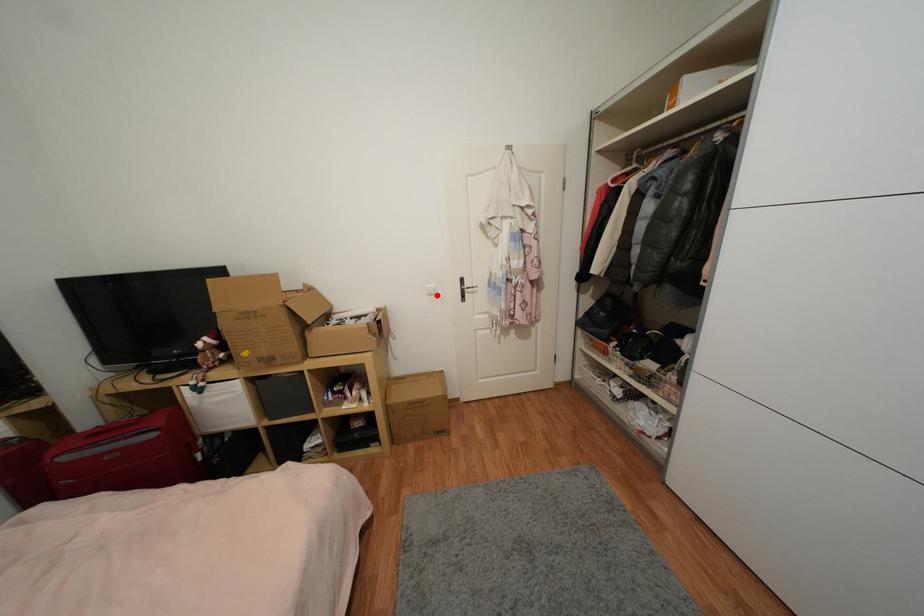
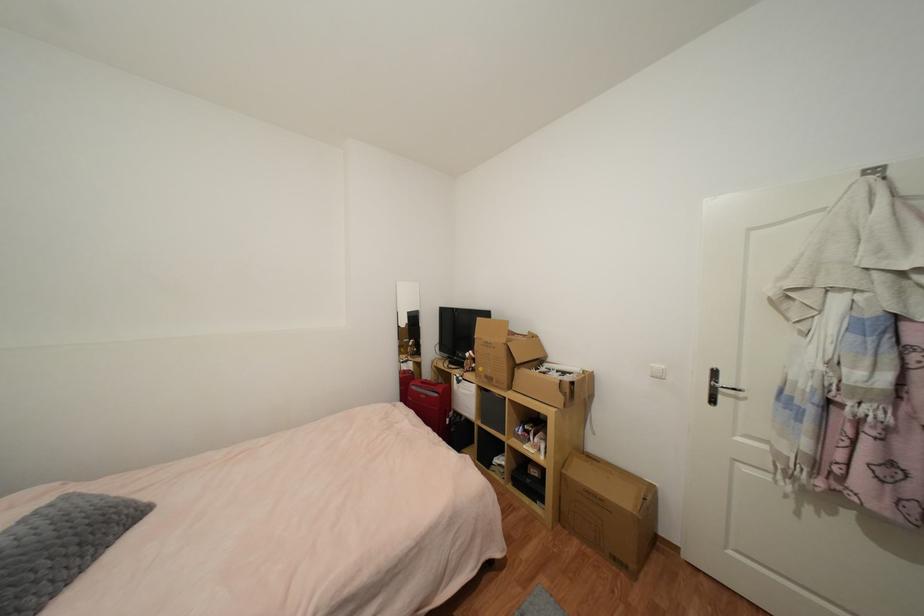
In the second image, find the point that corresponds to the highlighted location in the first image.

(663, 378)